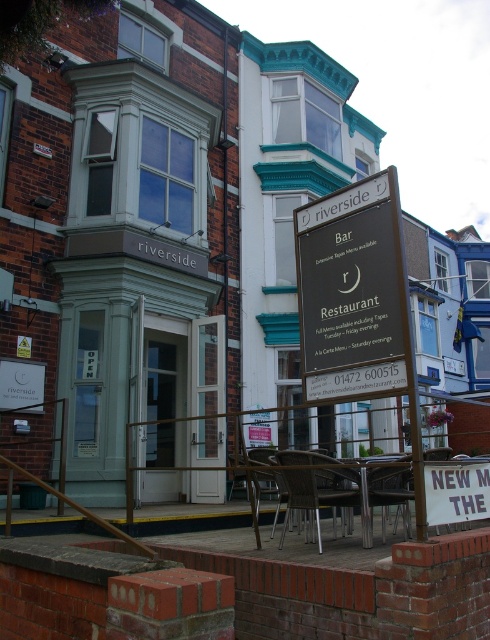
Question: Can you confirm if metallic silver chair at center is positioned above white wooden sign at center?

Choices:
 (A) no
 (B) yes

Answer: (A)

Question: Can you confirm if metallic silver chair at center is thinner than matte brown signboard at center?

Choices:
 (A) no
 (B) yes

Answer: (A)

Question: Can you confirm if black signboard at center is positioned below white wooden sign at center?

Choices:
 (A) no
 (B) yes

Answer: (A)

Question: Which object is farther from the camera taking this photo?

Choices:
 (A) white wooden sign at center
 (B) black signboard at center
 (C) metallic silver chair at center
 (D) matte brown signboard at center

Answer: (C)

Question: Which point appears closest to the camera in this image?

Choices:
 (A) (473, 512)
 (B) (316, 492)

Answer: (A)

Question: Which object is positioned closest to the white wooden sign at center?

Choices:
 (A) black signboard at center
 (B) metallic silver chair at center
 (C) matte brown signboard at center

Answer: (C)